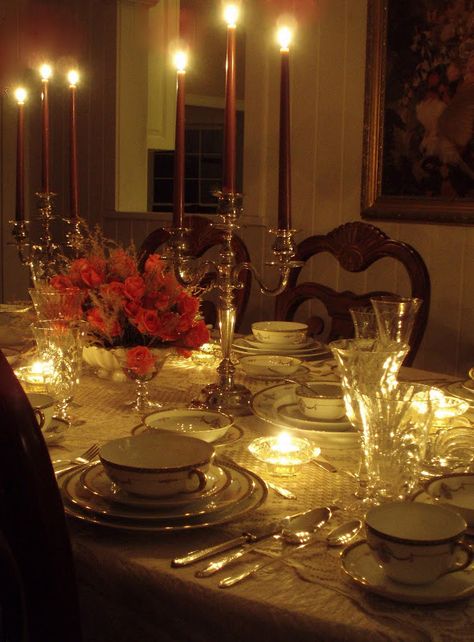
This screenshot has height=642, width=474. I want to click on silverware, so click(x=86, y=451), click(x=72, y=467), click(x=262, y=526), click(x=235, y=553), click(x=253, y=567), click(x=316, y=462), click(x=291, y=495), click(x=300, y=382), click(x=320, y=361).